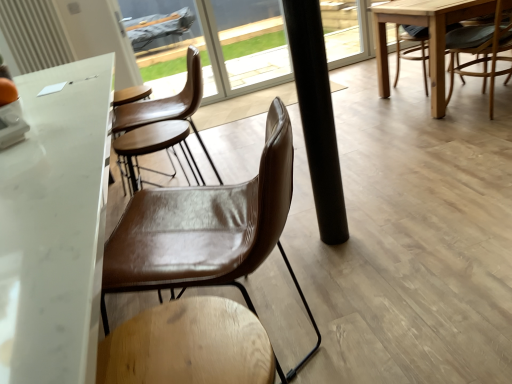
Question: Could you tell me if brown leather chair at right, acting as the 2th chair starting from the front, is facing black matte pole at center?

Choices:
 (A) yes
 (B) no

Answer: (B)

Question: From the image's perspective, is brown leather chair at right, placed as the 1th chair when sorted from top to bottom, on top of black matte pole at center?

Choices:
 (A) no
 (B) yes

Answer: (B)

Question: Is brown leather chair at right, placed as the second chair when sorted from left to right, shorter than black matte pole at center?

Choices:
 (A) no
 (B) yes

Answer: (B)

Question: Does brown leather chair at right, which is counted as the first chair, starting from the right, touch black matte pole at center?

Choices:
 (A) no
 (B) yes

Answer: (A)

Question: Does brown leather chair at right, placed as the 1th chair when sorted from top to bottom, appear on the right side of black matte pole at center?

Choices:
 (A) no
 (B) yes

Answer: (B)

Question: Is brown leather chair at right, acting as the second chair starting from the bottom, in front of black matte pole at center?

Choices:
 (A) yes
 (B) no

Answer: (B)

Question: Is brown leather chair at center, the 1th chair positioned from the bottom, at the right side of brown leather chair at right, which is counted as the first chair, starting from the right?

Choices:
 (A) yes
 (B) no

Answer: (B)

Question: Is brown leather chair at center, the 1th chair positioned from the bottom, thinner than brown leather chair at right, placed as the 1th chair when sorted from top to bottom?

Choices:
 (A) no
 (B) yes

Answer: (B)

Question: Does brown leather chair at center, which appears as the first chair when viewed from the left, have a lesser height compared to brown leather chair at right, acting as the second chair starting from the bottom?

Choices:
 (A) yes
 (B) no

Answer: (B)

Question: Would you say brown leather chair at center, the 1th chair positioned from the bottom, is outside brown leather chair at right, acting as the 2th chair starting from the front?

Choices:
 (A) yes
 (B) no

Answer: (A)

Question: Considering the relative sizes of brown leather chair at center, which appears as the first chair when viewed from the left, and brown leather chair at right, which is counted as the first chair, starting from the right, in the image provided, is brown leather chair at center, which appears as the first chair when viewed from the left, smaller than brown leather chair at right, which is counted as the first chair, starting from the right,?

Choices:
 (A) no
 (B) yes

Answer: (B)

Question: From the image's perspective, would you say brown leather chair at center, the 2th chair viewed from the right, is positioned over brown leather chair at right, placed as the second chair when sorted from left to right?

Choices:
 (A) yes
 (B) no

Answer: (B)

Question: Is brown leather chair at center, which is counted as the 2th chair, starting from the back, oriented away from white marble table at center?

Choices:
 (A) yes
 (B) no

Answer: (B)